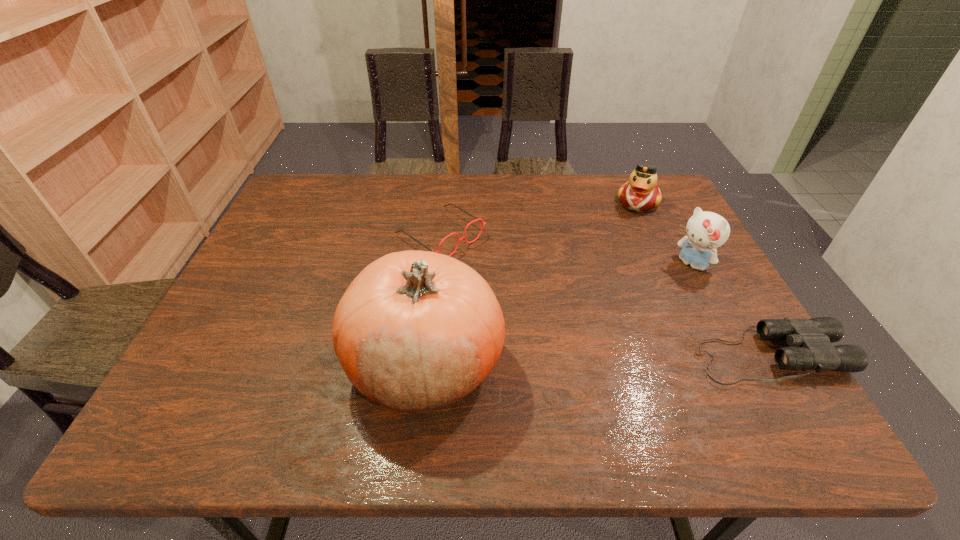
Where is `vacant spot on the desktop that is between the tallest object and the shortest object and is positioned on the front-facing side of the fourth tallest object`? This screenshot has height=540, width=960. vacant spot on the desktop that is between the tallest object and the shortest object and is positioned on the front-facing side of the fourth tallest object is located at coordinates (631, 359).

What are the coordinates of `free space on the desktop that is between the tallest object and the binoculars and is positioned on the front-facing side of the kitten` in the screenshot? It's located at (570, 360).

At what (x,y) coordinates should I click in order to perform the action: click on vacant space on the desktop that is between the pumpkin and the shortest object and is positioned on the face of the third shortest object. Please return your answer as a coordinate pair (x, y). This screenshot has width=960, height=540. Looking at the image, I should click on (586, 360).